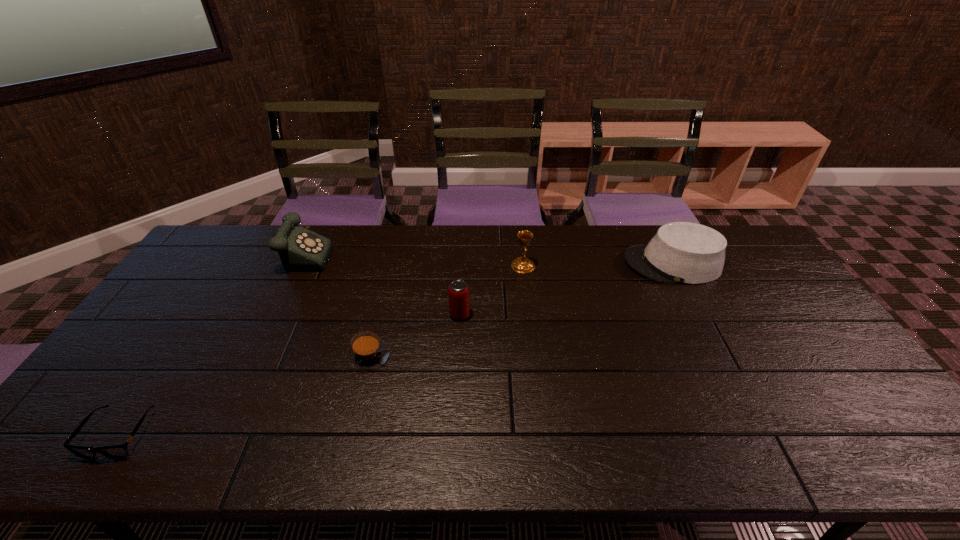
Where is `free space located on the left of the chalice`? This screenshot has height=540, width=960. free space located on the left of the chalice is located at coordinates (392, 266).

I want to click on blank area located 0.060m on the front of the fourth farthest object, so pos(459,338).

Find the location of `free spot located on the front-facing side of the hat`. free spot located on the front-facing side of the hat is located at coordinates (586, 264).

At what (x,y) coordinates should I click in order to perform the action: click on vacant space located 0.330m on the front-facing side of the hat. Please return your answer as a coordinate pair (x, y). Image resolution: width=960 pixels, height=540 pixels. Looking at the image, I should click on (526, 264).

The image size is (960, 540). Identify the location of vacant region located 0.090m on the front-facing side of the hat. (597, 264).

Locate an element on the screen. This screenshot has height=540, width=960. vacant space located on the front of the cappuccino is located at coordinates (347, 446).

I want to click on telephone that is at the far edge, so click(300, 249).

The image size is (960, 540). I want to click on chalice located at the far edge, so click(521, 264).

Locate an element on the screen. hat located in the far edge section of the desktop is located at coordinates (680, 252).

I want to click on object located in the near edge section of the desktop, so click(x=118, y=451).